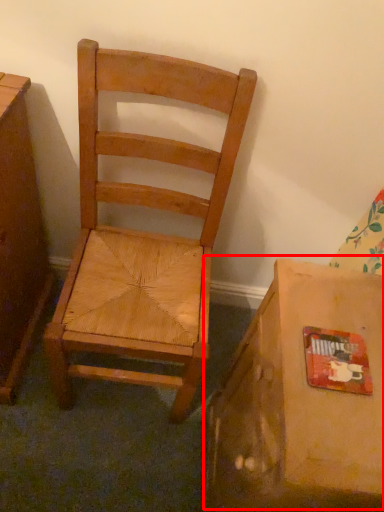
Question: Where is cardboard box (annotated by the red box) located in relation to chair in the image?

Choices:
 (A) left
 (B) right

Answer: (B)